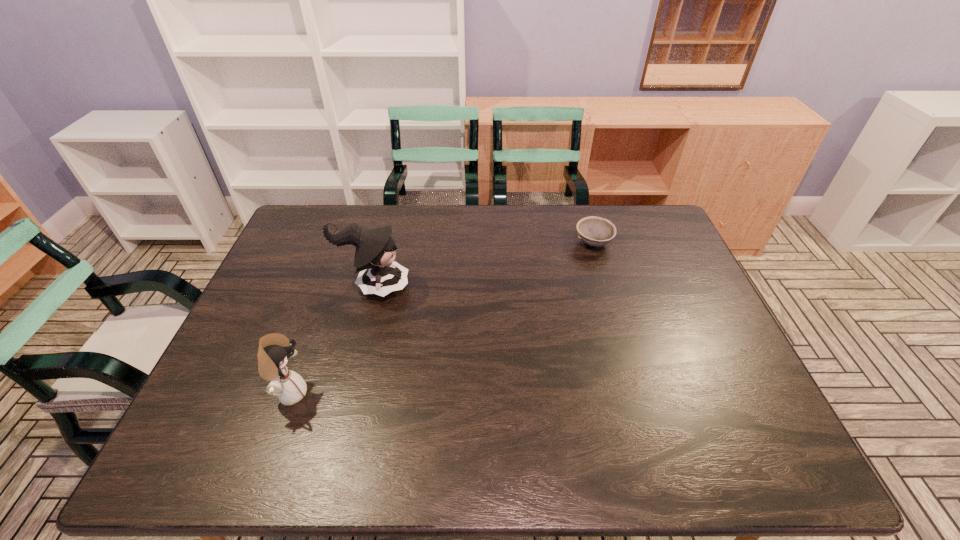
The height and width of the screenshot is (540, 960). I want to click on vacant area that lies between the bowl and the shorter doll, so click(x=442, y=318).

In order to click on free space between the second farthest object and the nearest object in this screenshot , I will do `click(332, 340)`.

At what (x,y) coordinates should I click in order to perform the action: click on free space between the second shortest object and the farthest object. Please return your answer as a coordinate pair (x, y). The height and width of the screenshot is (540, 960). Looking at the image, I should click on (442, 318).

You are a GUI agent. You are given a task and a screenshot of the screen. Output one action in this format:
    pyautogui.click(x=<x>, y=<y>)
    Task: Click on the free spot between the farther doll and the bowl
    The width and height of the screenshot is (960, 540).
    Given the screenshot: What is the action you would take?
    pyautogui.click(x=484, y=265)

Where is `free space between the second tallest object and the rightmost object`? The height and width of the screenshot is (540, 960). free space between the second tallest object and the rightmost object is located at coordinates (x=442, y=318).

You are a GUI agent. You are given a task and a screenshot of the screen. Output one action in this format:
    pyautogui.click(x=<x>, y=<y>)
    Task: Click on the vacant area that lies between the second farthest object and the farthest object
    
    Given the screenshot: What is the action you would take?
    pyautogui.click(x=484, y=265)

The height and width of the screenshot is (540, 960). Identify the location of vacant space that's between the farther doll and the nearest object. tap(332, 340).

What are the coordinates of `object that ranks as the closest to the farther doll` in the screenshot? It's located at (274, 349).

Select which object appears as the closest to the second farthest object. Please provide its 2D coordinates. Your answer should be formatted as a tuple, i.e. [(x, y)], where the tuple contains the x and y coordinates of a point satisfying the conditions above.

[(274, 349)]

In order to click on free space that satisfies the following two spatial constraints: 1. on the front side of the farthest object; 2. at the front face of the nearest object in this screenshot , I will do `click(638, 393)`.